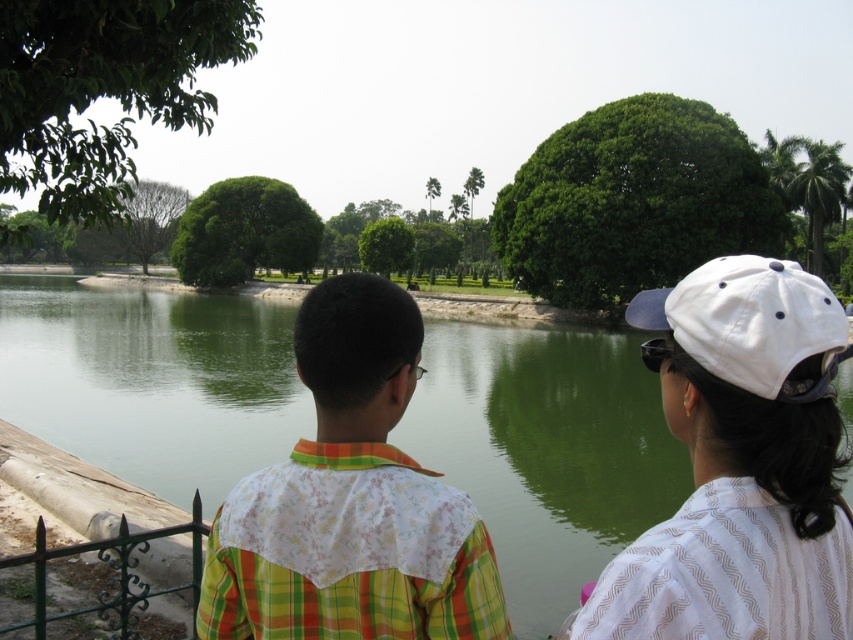
Question: Can you confirm if green liquid water at center is smaller than green wrought iron fence at lower left?

Choices:
 (A) yes
 (B) no

Answer: (B)

Question: Which point appears farthest from the camera in this image?

Choices:
 (A) (65, 548)
 (B) (724, 378)
 (C) (399, 472)

Answer: (A)

Question: Does white fabric cap at upper right appear on the left side of green wrought iron fence at lower left?

Choices:
 (A) yes
 (B) no

Answer: (B)

Question: Which point appears farthest from the camera in this image?

Choices:
 (A) (45, 556)
 (B) (223, 616)
 (C) (163, 476)
 (D) (709, 289)

Answer: (C)

Question: Does floral fabric shirt at center appear on the left side of green wrought iron fence at lower left?

Choices:
 (A) yes
 (B) no

Answer: (B)

Question: Which object is farther from the camera taking this photo?

Choices:
 (A) green liquid water at center
 (B) white fabric cap at upper right
 (C) floral fabric shirt at center

Answer: (C)